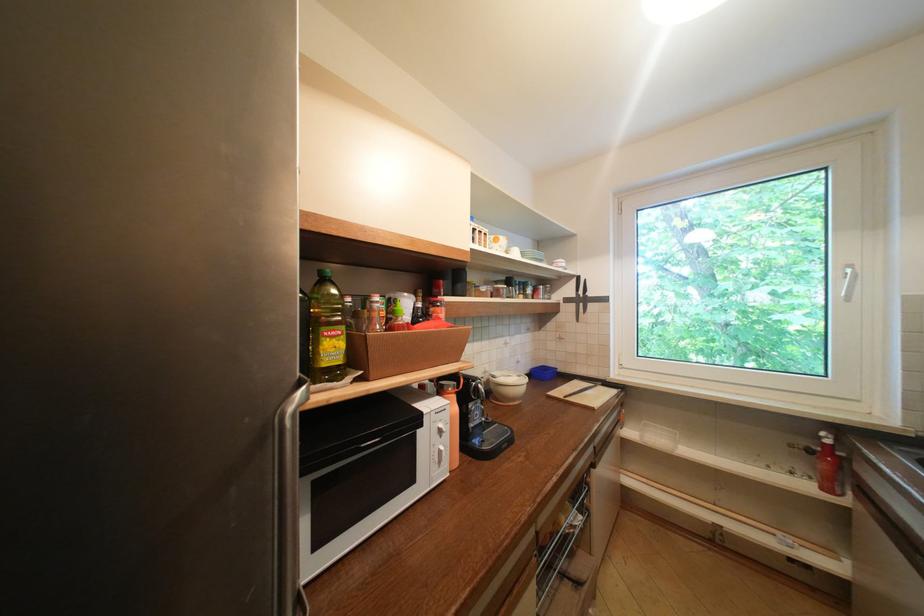
Where would you pull the silver refrigerator handle? Please return your answer as a coordinate pair (x, y).

(287, 501)